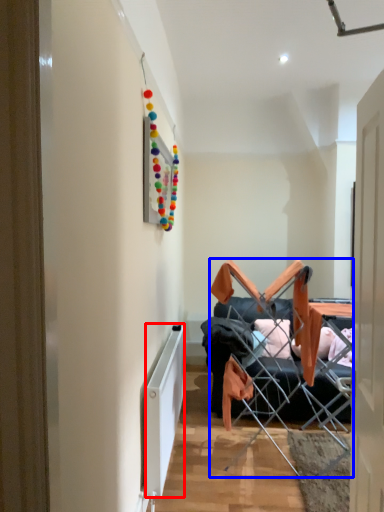
Question: Which object is closer to the camera taking this photo, radiator (highlighted by a red box) or chair (highlighted by a blue box)?

Choices:
 (A) radiator
 (B) chair

Answer: (A)